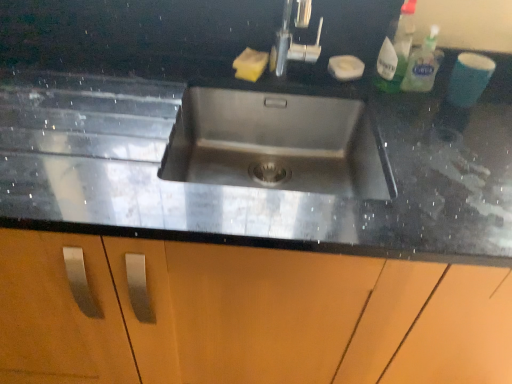
At what (x,y) coordinates should I click in order to perform the action: click on vacant space situated on the left part of white matte soap at upper right, which is the 2th soap from left to right. Please return your answer as a coordinate pair (x, y). Looking at the image, I should click on (296, 72).